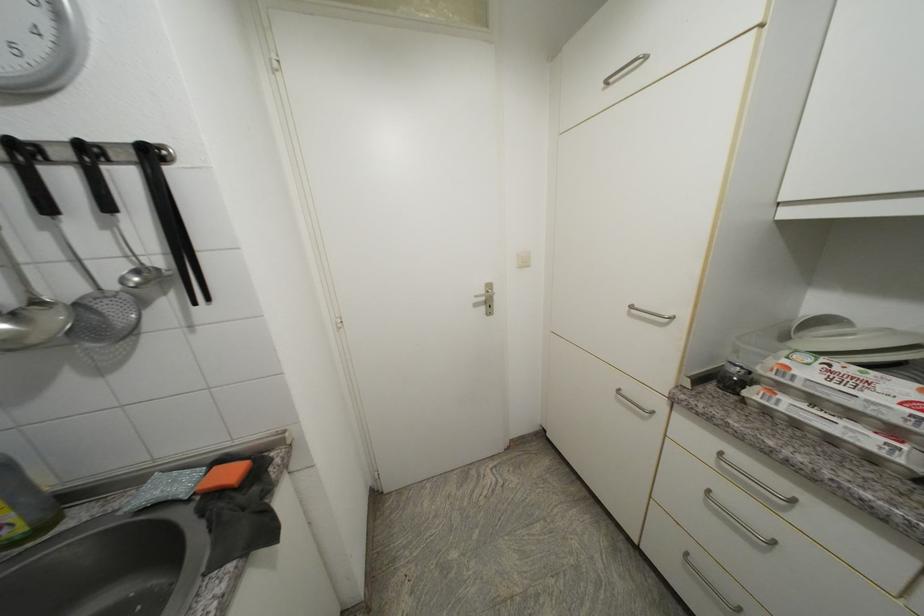
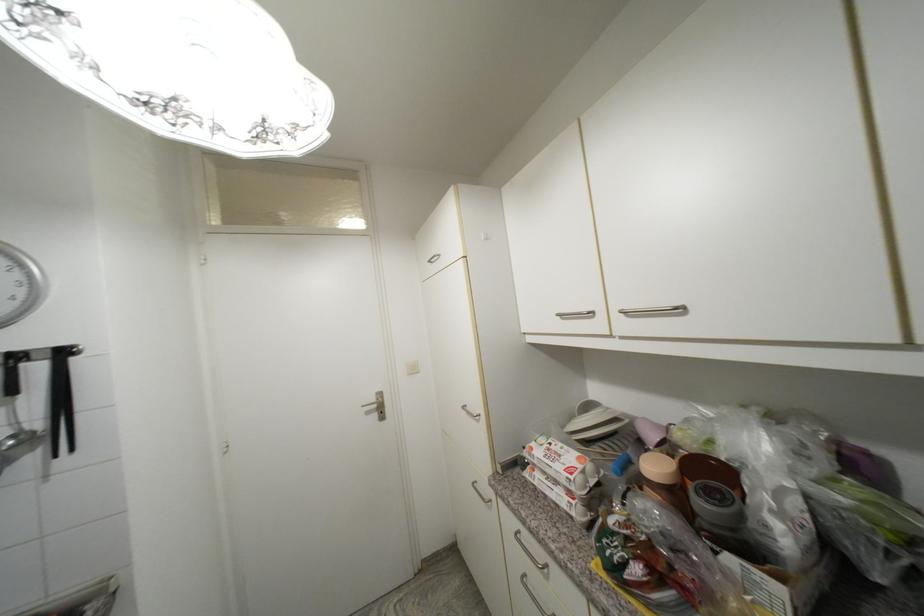
The images are taken continuously from a first-person perspective. In which direction are you moving?

The cameraman moved toward right, backward.